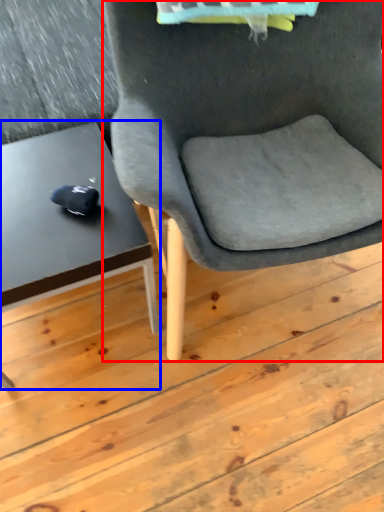
Question: Which of the following is the closest to the observer, chair (highlighted by a red box) or table (highlighted by a blue box)?

Choices:
 (A) chair
 (B) table

Answer: (A)